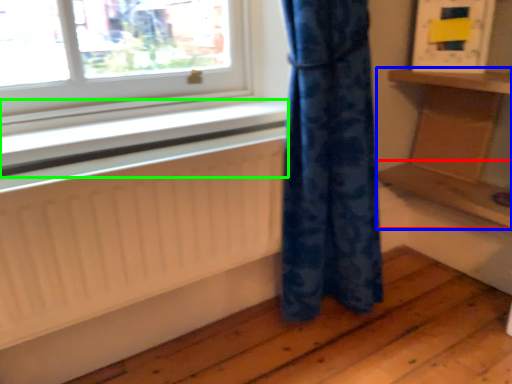
Question: Based on their relative distances, which object is farther from shelf (highlighted by a red box)? Choose from furniture (highlighted by a blue box) and window sill (highlighted by a green box).

Choices:
 (A) furniture
 (B) window sill

Answer: (B)